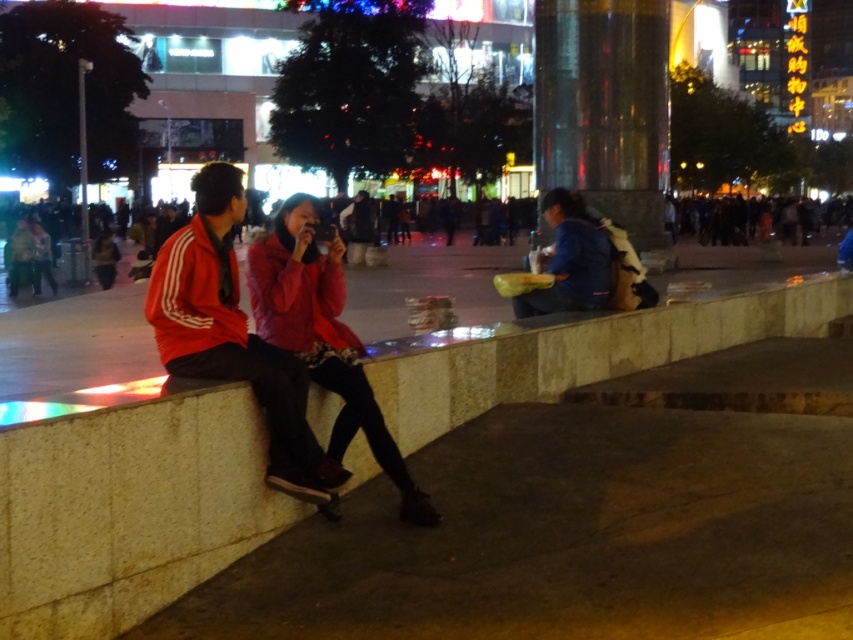
Question: Is transparent glass pillar at center above red matte jacket at left?

Choices:
 (A) no
 (B) yes

Answer: (B)

Question: Which is farther from the blue fabric bag at center?

Choices:
 (A) red matte jacket at left
 (B) transparent glass pillar at center

Answer: (B)

Question: Which point is farther to the camera?

Choices:
 (A) (285, 417)
 (B) (643, 3)

Answer: (B)

Question: Can you confirm if transparent glass pillar at center is thinner than blue fabric bag at center?

Choices:
 (A) no
 (B) yes

Answer: (B)

Question: Which point appears farthest from the camera in this image?

Choices:
 (A) [181, 298]
 (B) [570, 212]
 (C) [630, 1]

Answer: (C)

Question: Can you confirm if red matte jacket at left is positioned below blue fabric bag at center?

Choices:
 (A) yes
 (B) no

Answer: (A)